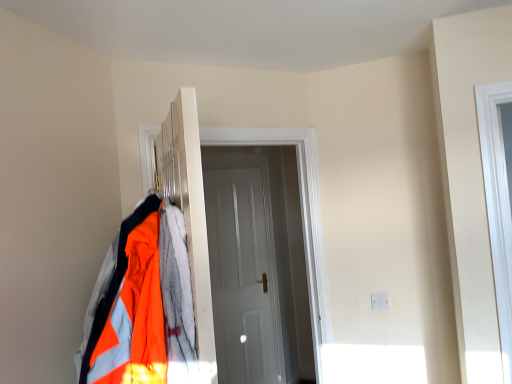
Question: From a real-world perspective, is white glossy door at center, positioned as the second door in back-to-front order, positioned above or below white matte door at center, which is counted as the second door, starting from the front?

Choices:
 (A) below
 (B) above

Answer: (B)

Question: Is white glossy door at center, the first door in the front-to-back sequence, taller or shorter than white matte door at center, which is counted as the second door, starting from the front?

Choices:
 (A) tall
 (B) short

Answer: (B)

Question: Based on their relative distances, which object is nearer to the reflective fabric jacket at left?

Choices:
 (A) white matte door at center, marked as the first door in a back-to-front arrangement
 (B) white glossy door at center, the first door in the front-to-back sequence
 (C) metallic silver coat rack at center

Answer: (C)

Question: Based on their relative distances, which object is farther from the metallic silver coat rack at center?

Choices:
 (A) white glossy door at center, positioned as the second door in back-to-front order
 (B) reflective fabric jacket at left
 (C) white matte door at center, marked as the first door in a back-to-front arrangement

Answer: (C)